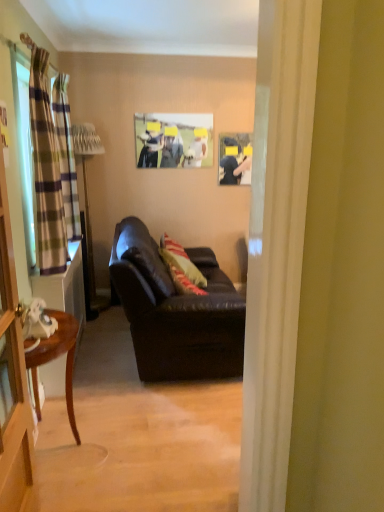
What do you see at coordinates (88, 217) in the screenshot? Image resolution: width=384 pixels, height=512 pixels. I see `metallic silver floor lamp at left` at bounding box center [88, 217].

The width and height of the screenshot is (384, 512). Identify the location of leather couch at center. (176, 312).

This screenshot has width=384, height=512. I want to click on white glossy cabinet at left, so click(65, 288).

The width and height of the screenshot is (384, 512). What do you see at coordinates (66, 156) in the screenshot? I see `plaid fabric curtain at left, the second curtain in the front-to-back sequence` at bounding box center [66, 156].

You are a GUI agent. You are given a task and a screenshot of the screen. Output one action in this format:
    pyautogui.click(x=<x>, y=<y>)
    Task: Click on the metallic silver floor lamp at left
    The width and height of the screenshot is (384, 512).
    Given the screenshot: What is the action you would take?
    pyautogui.click(x=88, y=217)

Which curtain is the 2nd one when counting from the front of the metallic silver floor lamp at left? Please provide its 2D coordinates.

[(46, 172)]

Which of these two, metallic silver floor lamp at left or green plaid curtain at left, positioned as the 2th curtain in back-to-front order, is bigger?

metallic silver floor lamp at left is bigger.

Is metallic silver floor lamp at left taller or shorter than green plaid curtain at left, positioned as the 2th curtain in back-to-front order?

Considering their sizes, metallic silver floor lamp at left has more height than green plaid curtain at left, positioned as the 2th curtain in back-to-front order.

Between metallic silver floor lamp at left and green plaid curtain at left, which is the 1th curtain in front-to-back order, which one appears on the right side from the viewer's perspective?

green plaid curtain at left, which is the 1th curtain in front-to-back order.

How many degrees apart are the facing directions of white glossy cabinet at left and leather couch at center?

0.248 degrees separate the facing orientations of white glossy cabinet at left and leather couch at center.

Is white glossy cabinet at left taller or shorter than leather couch at center?

In the image, white glossy cabinet at left appears to be shorter than leather couch at center.

In the scene shown: Would you say leather couch at center is part of white glossy cabinet at left's contents?

No, white glossy cabinet at left does not contain leather couch at center.

Could you tell me if white glossy cabinet at left is facing leather couch at center?

Yes, white glossy cabinet at left is aimed at leather couch at center.

Is green plaid curtain at left, positioned as the 2th curtain in back-to-front order, bigger than metallic silver floor lamp at left?

Incorrect, green plaid curtain at left, positioned as the 2th curtain in back-to-front order, is not larger than metallic silver floor lamp at left.

Considering the relative sizes of green plaid curtain at left, positioned as the 2th curtain in back-to-front order, and metallic silver floor lamp at left in the image provided, is green plaid curtain at left, positioned as the 2th curtain in back-to-front order, shorter than metallic silver floor lamp at left?

Indeed, green plaid curtain at left, positioned as the 2th curtain in back-to-front order, has a lesser height compared to metallic silver floor lamp at left.

Could you measure the distance between green plaid curtain at left, positioned as the 2th curtain in back-to-front order, and metallic silver floor lamp at left?

The distance of green plaid curtain at left, positioned as the 2th curtain in back-to-front order, from metallic silver floor lamp at left is 1.40 meters.

Could you tell me if green plaid curtain at left, positioned as the 2th curtain in back-to-front order, is turned towards metallic silver floor lamp at left?

No, green plaid curtain at left, positioned as the 2th curtain in back-to-front order, is not facing towards metallic silver floor lamp at left.

Which is less distant, [161,165] or [118,245]?

Point [161,165] is farther from the camera than point [118,245].

Would you consider matte plastic picture frame at upper center to be distant from leather couch at center?

Absolutely, matte plastic picture frame at upper center is distant from leather couch at center.

Could you tell me if matte plastic picture frame at upper center is turned towards leather couch at center?

No, matte plastic picture frame at upper center is not facing towards leather couch at center.

Considering the relative sizes of matte plastic picture frame at upper center and leather couch at center in the image provided, is matte plastic picture frame at upper center taller than leather couch at center?

In fact, matte plastic picture frame at upper center may be shorter than leather couch at center.

How much distance is there between plaid fabric curtain at left, the second curtain in the front-to-back sequence, and white glossy cabinet at left?

plaid fabric curtain at left, the second curtain in the front-to-back sequence, is 37.54 inches from white glossy cabinet at left.

Is plaid fabric curtain at left, the 1th curtain viewed from the back, further to camera compared to white glossy cabinet at left?

Yes, it is.

From the image's perspective, does plaid fabric curtain at left, the 1th curtain viewed from the back, appear lower than white glossy cabinet at left?

No, from the image's perspective, plaid fabric curtain at left, the 1th curtain viewed from the back, is not beneath white glossy cabinet at left.

Is plaid fabric curtain at left, the second curtain in the front-to-back sequence, thinner than white glossy cabinet at left?

Yes, plaid fabric curtain at left, the second curtain in the front-to-back sequence, is thinner than white glossy cabinet at left.

How distant is green plaid curtain at left, which is the 1th curtain in front-to-back order, from striped fabric pillow at center?

They are 1.12 meters apart.

From the image's perspective, which curtain is the 1st one above the striped fabric pillow at center? Please provide its 2D coordinates.

[(46, 172)]

Is green plaid curtain at left, which is the 1th curtain in front-to-back order, positioned beyond the bounds of striped fabric pillow at center?

That's correct, green plaid curtain at left, which is the 1th curtain in front-to-back order, is outside of striped fabric pillow at center.

Who is bigger, green plaid curtain at left, which is the 1th curtain in front-to-back order, or striped fabric pillow at center?

striped fabric pillow at center.

In the scene shown: Visually, is leather couch at center positioned to the left or to the right of white glossy cabinet at left?

Based on their positions, leather couch at center is located to the right of white glossy cabinet at left.

Is point (138, 327) closer or farther from the camera than point (50, 285)?

Point (138, 327).

From the image's perspective, between leather couch at center and white glossy cabinet at left, which one is located above?

leather couch at center appears higher in the image.

Is leather couch at center oriented towards white glossy cabinet at left?

No, leather couch at center is not oriented towards white glossy cabinet at left.

Starting from the metallic silver floor lamp at left, which curtain is the 2nd one in front? Please provide its 2D coordinates.

[(46, 172)]

The image size is (384, 512). There is a white glossy cabinet at left. In order to click on studio couch above it (from a real-world perspective) in this screenshot , I will do point(176,312).

When comparing their distances from striped fabric pillow at center, does white glossy cabinet at left or plaid fabric curtain at left, the 1th curtain viewed from the back, seem further?

Based on the image, plaid fabric curtain at left, the 1th curtain viewed from the back, appears to be further to striped fabric pillow at center.

Which object lies nearer to the anchor point green plaid curtain at left, which is the 1th curtain in front-to-back order, white glossy cabinet at left or striped fabric pillow at center?

white glossy cabinet at left lies closer to green plaid curtain at left, which is the 1th curtain in front-to-back order, than the other object.

From the image, which object appears to be farther from green plaid curtain at left, positioned as the 2th curtain in back-to-front order, plaid fabric curtain at left, the second curtain in the front-to-back sequence, or white glossy cabinet at left?

white glossy cabinet at left is positioned further to the anchor green plaid curtain at left, positioned as the 2th curtain in back-to-front order.

Looking at the image, which one is located further to matte plastic picture frame at upper center, metallic silver floor lamp at left or plaid fabric curtain at left, the 1th curtain viewed from the back?

plaid fabric curtain at left, the 1th curtain viewed from the back, lies further to matte plastic picture frame at upper center than the other object.

Consider the image. Which object lies nearer to the anchor point plaid fabric curtain at left, the second curtain in the front-to-back sequence, clear plastic screen door at left or metallic silver floor lamp at left?

The object closer to plaid fabric curtain at left, the second curtain in the front-to-back sequence, is clear plastic screen door at left.

Considering their positions, is plaid fabric curtain at left, the second curtain in the front-to-back sequence, positioned further to matte plastic picture frame at upper center than metallic silver floor lamp at left?

Among the two, plaid fabric curtain at left, the second curtain in the front-to-back sequence, is located further to matte plastic picture frame at upper center.

Which object lies further to the anchor point leather couch at center, white glossy cabinet at left or matte plastic picture frame at upper center?

Among the two, matte plastic picture frame at upper center is located further to leather couch at center.

From the image, which object appears to be farther from white glossy cabinet at left, plaid fabric curtain at left, the 1th curtain viewed from the back, or green plaid curtain at left, which is the 1th curtain in front-to-back order?

green plaid curtain at left, which is the 1th curtain in front-to-back order, is further to white glossy cabinet at left.

Image resolution: width=384 pixels, height=512 pixels. I want to click on studio couch located between clear plastic screen door at left and plaid fabric curtain at left, the second curtain in the front-to-back sequence, in the depth direction, so click(x=176, y=312).

This screenshot has width=384, height=512. In order to click on lamp positioned between leather couch at center and matte plastic picture frame at upper center from near to far in this screenshot , I will do `click(88, 217)`.

Where is `cabinetry between clear plastic screen door at left and metallic silver floor lamp at left in the front-back direction`? Image resolution: width=384 pixels, height=512 pixels. cabinetry between clear plastic screen door at left and metallic silver floor lamp at left in the front-back direction is located at coordinates (65, 288).

Locate an element on the screen. curtain positioned between leather couch at center and metallic silver floor lamp at left from near to far is located at coordinates (66, 156).